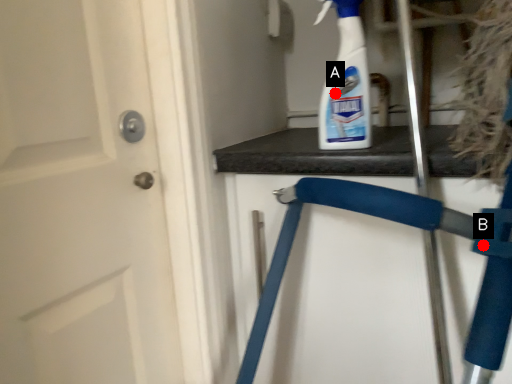
Question: Two points are circled on the image, labeled by A and B beside each circle. Which point is closer to the camera?

Choices:
 (A) A is closer
 (B) B is closer

Answer: (B)